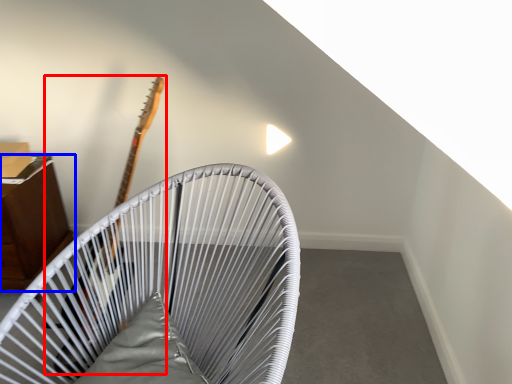
Question: Among these objects, which one is nearest to the camera, guitar (highlighted by a red box) or furniture (highlighted by a blue box)?

Choices:
 (A) guitar
 (B) furniture

Answer: (A)